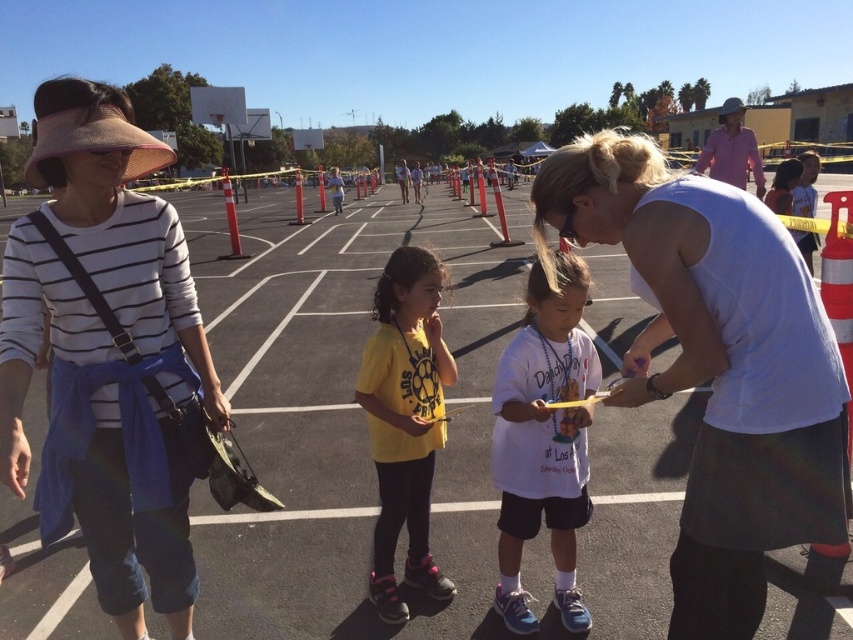
Question: Among these objects, which one is nearest to the camera?

Choices:
 (A) matte striped shirt at left
 (B) white cotton shirt at center
 (C) asphalt at center

Answer: (A)

Question: Which point appears closest to the camera in this image?

Choices:
 (A) (376, 467)
 (B) (517, 568)
 (C) (102, 172)

Answer: (C)

Question: Is asphalt at center wider than white cotton shirt at center?

Choices:
 (A) no
 (B) yes

Answer: (B)

Question: Does white cotton shirt at center appear under white matte shirt at center?

Choices:
 (A) yes
 (B) no

Answer: (B)

Question: Can you confirm if matte striped shirt at left is positioned below yellow matte shirt at center?

Choices:
 (A) no
 (B) yes

Answer: (A)

Question: Among these objects, which one is nearest to the camera?

Choices:
 (A) yellow matte shirt at center
 (B) white matte shirt at center
 (C) matte striped shirt at left

Answer: (C)